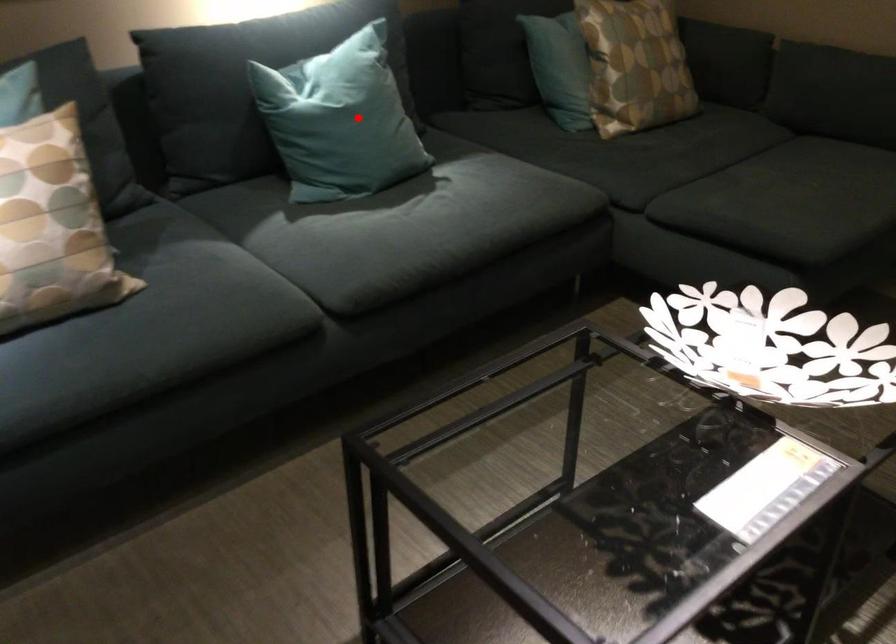
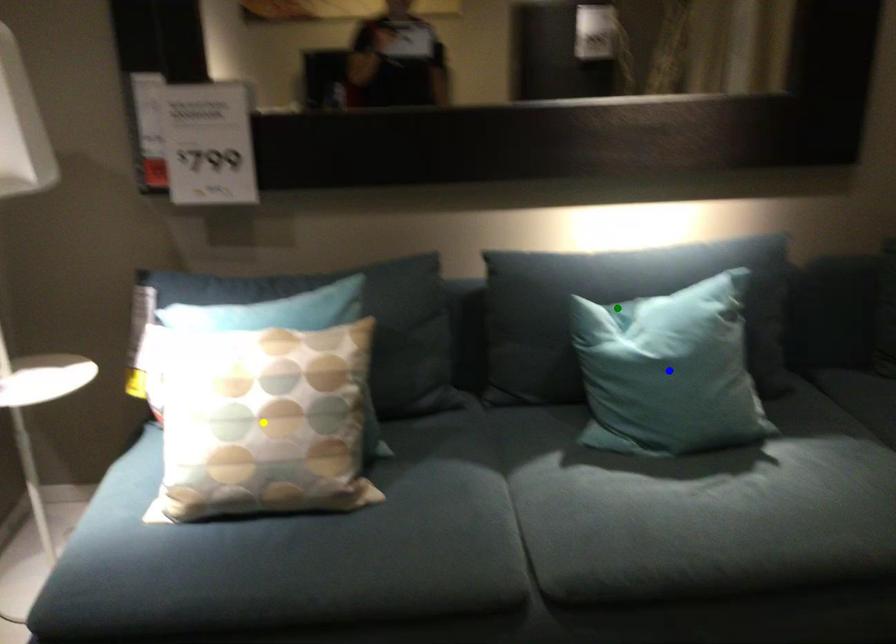
Question: I am providing you with two images of the same scene from different viewpoints. A red point is marked on the first image. You are given multiple points on the second image. Can you choose the point in image 2 that corresponds to the point in image 1?

Choices:
 (A) green point
 (B) yellow point
 (C) blue point

Answer: (C)